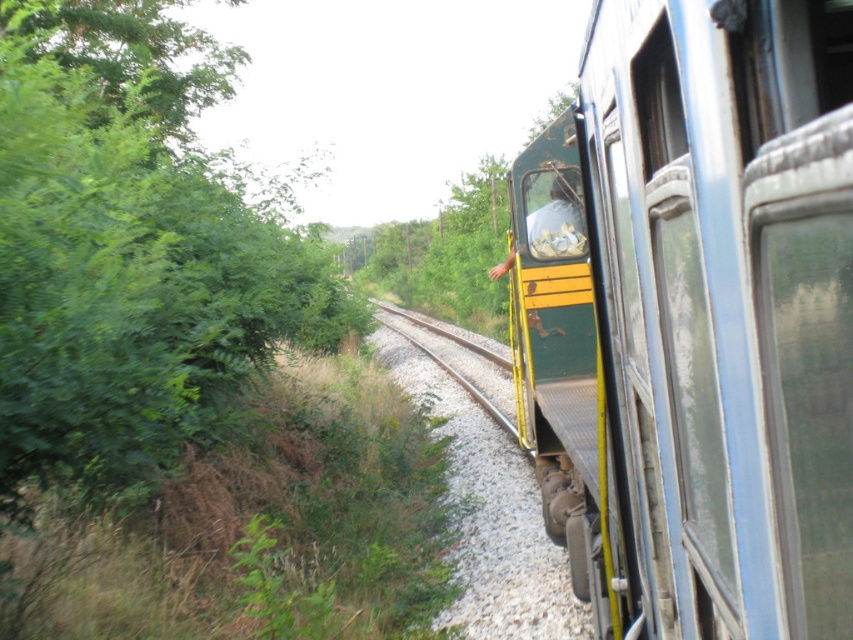
Question: Which point is closer to the camera?

Choices:
 (A) (575, 202)
 (B) (48, 481)
 (C) (724, 157)

Answer: (C)

Question: Is green leafy tree at left thinner than yellow metal track at center?

Choices:
 (A) yes
 (B) no

Answer: (B)

Question: Which of the following is the closest to the observer?

Choices:
 (A) (538, 228)
 (B) (514, 428)
 (C) (9, 378)
 (D) (640, 136)

Answer: (D)

Question: Is green matte train at center closer to the viewer compared to clear glass window at center?

Choices:
 (A) yes
 (B) no

Answer: (A)

Question: Is clear glass window at center below yellow metal track at center?

Choices:
 (A) no
 (B) yes

Answer: (A)

Question: Among these objects, which one is farthest from the camera?

Choices:
 (A) green matte train at center
 (B) green leafy tree at left

Answer: (B)